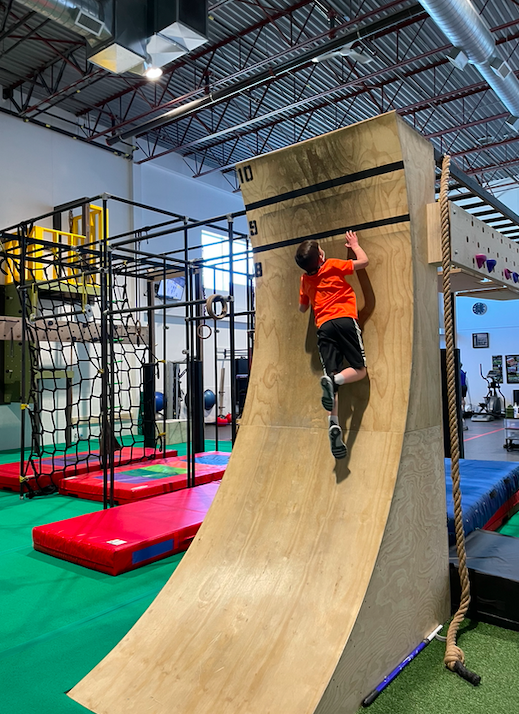
Find the location of a particular element. The image size is (519, 714). child's right sock is located at coordinates 341,381.